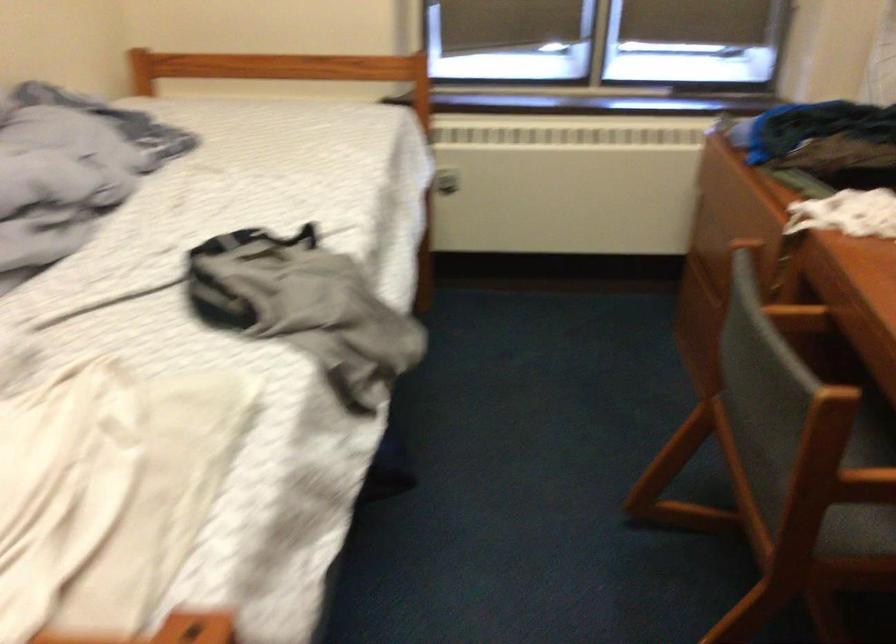
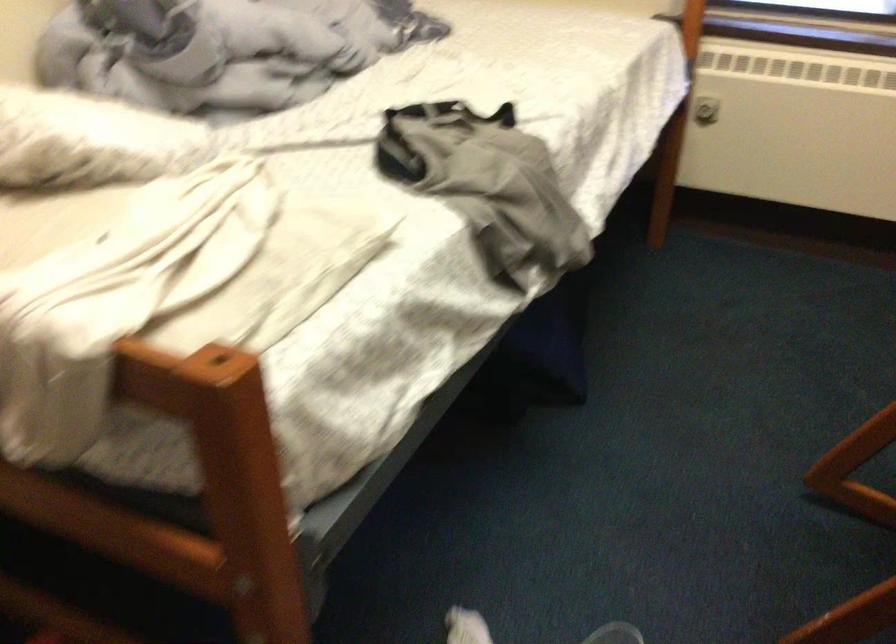
Question: The images are taken continuously from a first-person perspective. In which direction are you moving?

Choices:
 (A) Left
 (B) Right
 (C) Forward
 (D) Backward

Answer: (B)